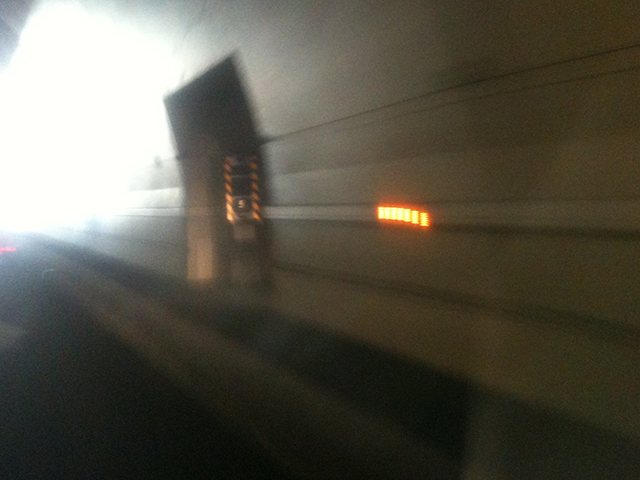
Find the location of a particular element. door is located at coordinates (224, 246).